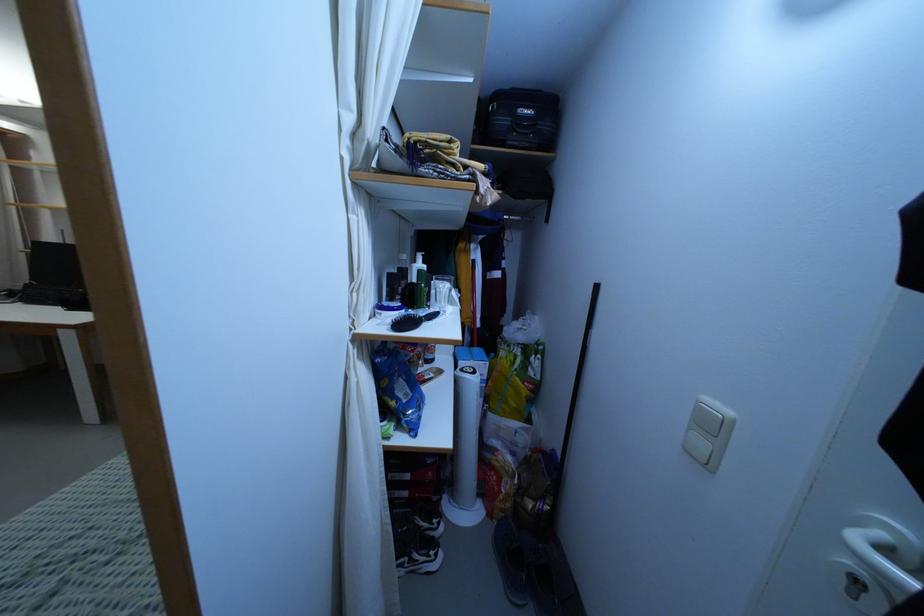
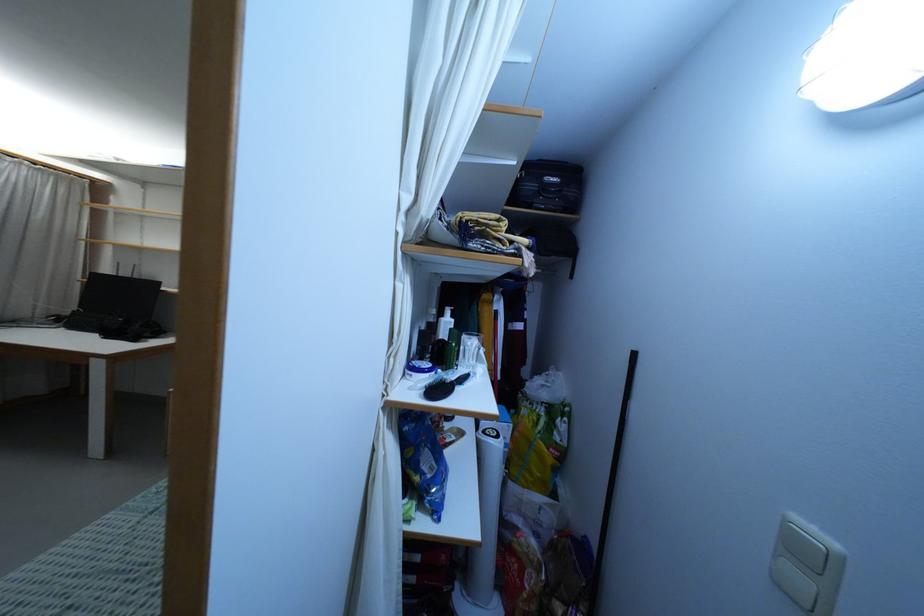
Where in the second image is the point corresponding to point (419, 317) from the first image?

(452, 382)